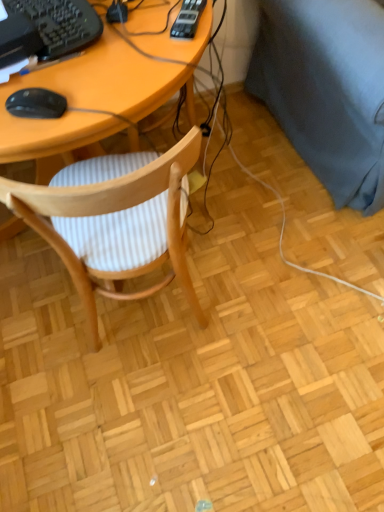
Where is `free space behind black matte mouse at left`? free space behind black matte mouse at left is located at coordinates (70, 67).